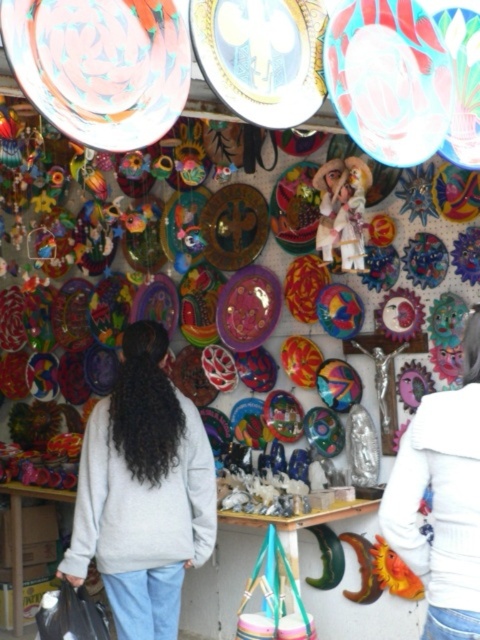
Which is behind, point (460, 598) or point (371, 44)?

The point (371, 44) is more distant.

Is point (447, 547) farther from viewer compared to point (418, 113)?

No, (447, 547) is in front of (418, 113).

Find the location of a particular element. The height and width of the screenshot is (640, 480). white matte jacket at upper right is located at coordinates (442, 499).

Does white matte jacket at upper right have a smaller size compared to metallic gold mask at center?

Actually, white matte jacket at upper right might be larger than metallic gold mask at center.

Looking at this image, does white matte jacket at upper right have a greater height compared to metallic gold mask at center?

Yes, white matte jacket at upper right is taller than metallic gold mask at center.

Where is `white matte jacket at upper right`? The width and height of the screenshot is (480, 640). white matte jacket at upper right is located at coordinates (442, 499).

Find the location of a particular element. white matte jacket at upper right is located at coordinates (442, 499).

Does matte multicolored plate at upper left have a smaller size compared to white matte jacket at upper right?

Correct, matte multicolored plate at upper left occupies less space than white matte jacket at upper right.

Who is higher up, matte multicolored plate at upper left or white matte jacket at upper right?

Positioned higher is matte multicolored plate at upper left.

Identify the location of matte multicolored plate at upper left. (100, 67).